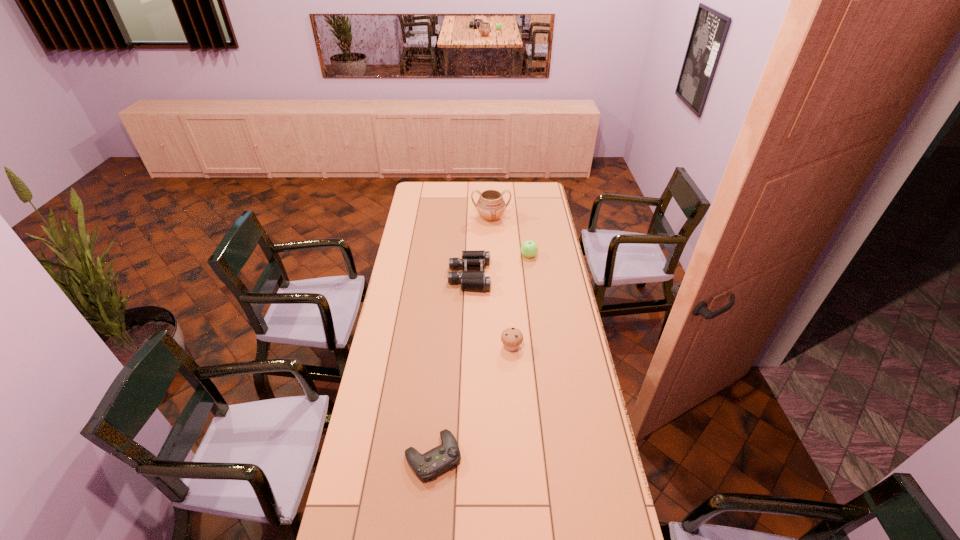
The height and width of the screenshot is (540, 960). What are the coordinates of `empty location between the rightmost object and the farthest object` in the screenshot? It's located at (510, 237).

Identify the location of vacant space that is in between the rightmost object and the control. Image resolution: width=960 pixels, height=540 pixels. (481, 356).

Image resolution: width=960 pixels, height=540 pixels. What are the coordinates of `free point between the binoculars and the fourth farthest object` in the screenshot? It's located at (491, 312).

Find the location of a particular element. This screenshot has width=960, height=540. vacant space that is in between the apple and the nearest object is located at coordinates (481, 356).

This screenshot has height=540, width=960. Find the location of `empty location between the nearest object and the fourth farthest object`. empty location between the nearest object and the fourth farthest object is located at coordinates (472, 402).

Locate an element on the screen. The width and height of the screenshot is (960, 540). free space between the second nearest object and the binoculars is located at coordinates (x=491, y=312).

Select which object is the third closest to the apple. Please provide its 2D coordinates. Your answer should be formatted as a tuple, i.e. [(x, y)], where the tuple contains the x and y coordinates of a point satisfying the conditions above.

[(512, 337)]

Identify the location of object identified as the fourth closest to the urn. (439, 459).

Locate an element on the screen. This screenshot has height=540, width=960. vacant space that satisfies the following two spatial constraints: 1. on the front-facing side of the farthest object; 2. on the right side of the rightmost object is located at coordinates (492, 256).

Find the location of a particular element. The image size is (960, 540). vacant area that satisfies the following two spatial constraints: 1. on the front-facing side of the binoculars; 2. on the left side of the muffin is located at coordinates (468, 347).